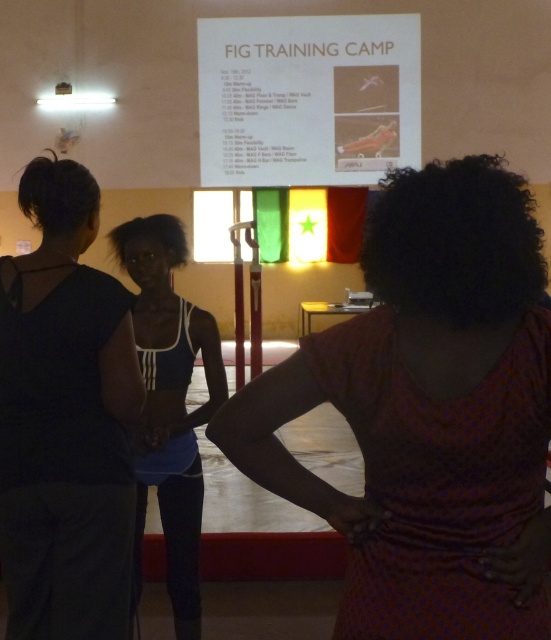
Question: Which of the following is the farthest from the observer?

Choices:
 (A) (171, 241)
 (B) (526, 253)
 (C) (370, 70)
 (D) (9, 476)

Answer: (C)

Question: Which point is farther from the camera taking this photo?

Choices:
 (A) (170, 435)
 (B) (482, 250)
 (C) (74, 346)

Answer: (A)

Question: Does printed cotton dress at center appear on the left side of white paper at upper center?

Choices:
 (A) yes
 (B) no

Answer: (A)

Question: Does black matte tank top at left come in front of white paper at upper center?

Choices:
 (A) yes
 (B) no

Answer: (A)

Question: Which point appears closest to the camera in this image?

Choices:
 (A) pos(491,477)
 (B) pos(193,330)

Answer: (A)

Question: Is black matte tank top at left thinner than white paper at upper center?

Choices:
 (A) yes
 (B) no

Answer: (A)